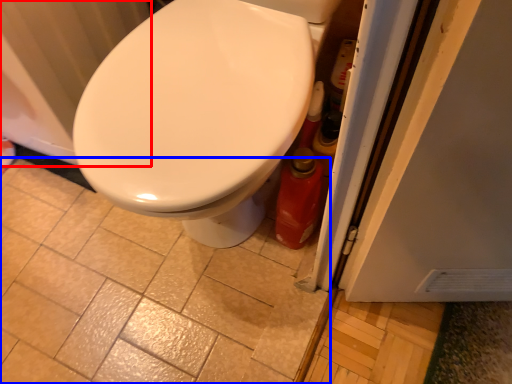
Question: Which object appears farthest to the camera in this image, radiator (highlighted by a red box) or ceramic tile (highlighted by a blue box)?

Choices:
 (A) radiator
 (B) ceramic tile

Answer: (B)